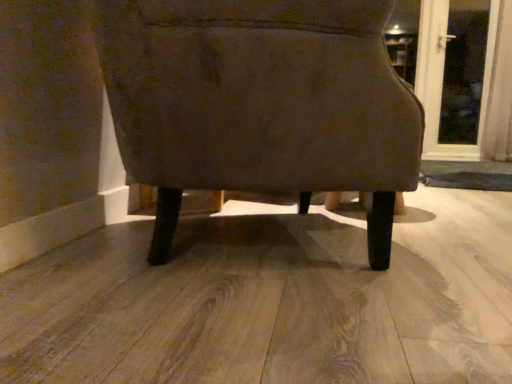
Describe the element at coordinates (259, 103) in the screenshot. I see `suede-like brown chair at center` at that location.

Find the location of `suede-like brown chair at center`. suede-like brown chair at center is located at coordinates (259, 103).

Locate an element on the screen. The image size is (512, 384). transparent glass door at upper right is located at coordinates (436, 81).

What do you see at coordinates (436, 81) in the screenshot? I see `transparent glass door at upper right` at bounding box center [436, 81].

This screenshot has height=384, width=512. I want to click on suede-like brown chair at center, so click(259, 103).

Considering the positions of objects transparent glass door at upper right and suede-like brown chair at center in the image provided, who is more to the right, transparent glass door at upper right or suede-like brown chair at center?

transparent glass door at upper right.

Which object is closer to the camera, transparent glass door at upper right or suede-like brown chair at center?

Positioned in front is suede-like brown chair at center.

Which is closer to the camera, (429, 150) or (229, 8)?

Point (429, 150).

From the image's perspective, which is below, transparent glass door at upper right or suede-like brown chair at center?

suede-like brown chair at center, from the image's perspective.

From the picture: From a real-world perspective, who is located lower, transparent glass door at upper right or suede-like brown chair at center?

suede-like brown chair at center, from a real-world perspective.

Considering the sizes of objects transparent glass door at upper right and suede-like brown chair at center in the image provided, who is wider, transparent glass door at upper right or suede-like brown chair at center?

Wider between the two is suede-like brown chair at center.

Is transparent glass door at upper right taller than suede-like brown chair at center?

Yes.

Between transparent glass door at upper right and suede-like brown chair at center, which one has larger size?

Bigger between the two is suede-like brown chair at center.

Is transparent glass door at upper right outside of suede-like brown chair at center?

Yes, transparent glass door at upper right is located beyond the bounds of suede-like brown chair at center.

Is transparent glass door at upper right far from suede-like brown chair at center?

Yes, transparent glass door at upper right and suede-like brown chair at center are quite far apart.

Is transparent glass door at upper right turned away from suede-like brown chair at center?

No, transparent glass door at upper right's orientation is not away from suede-like brown chair at center.

What's the angular difference between transparent glass door at upper right and suede-like brown chair at center's facing directions?

111 degrees.

Identify the location of screen door lying behind the suede-like brown chair at center. Image resolution: width=512 pixels, height=384 pixels. (436, 81).

Which object is positioned more to the right, suede-like brown chair at center or transparent glass door at upper right?

transparent glass door at upper right is more to the right.

Considering the positions of objects suede-like brown chair at center and transparent glass door at upper right in the image provided, who is in front, suede-like brown chair at center or transparent glass door at upper right?

suede-like brown chair at center is closer to the camera.

Considering the positions of point (219, 131) and point (464, 150), is point (219, 131) closer or farther from the camera than point (464, 150)?

Clearly, point (219, 131) is closer to the camera than point (464, 150).

From the image's perspective, relative to transparent glass door at upper right, is suede-like brown chair at center above or below?

Clearly, from the image's perspective, suede-like brown chair at center is below transparent glass door at upper right.

From a real-world perspective, is suede-like brown chair at center above or below transparent glass door at upper right?

In terms of real-world spatial position, suede-like brown chair at center is below transparent glass door at upper right.

Which object is wider, suede-like brown chair at center or transparent glass door at upper right?

Wider between the two is suede-like brown chair at center.

Does suede-like brown chair at center have a lesser height compared to transparent glass door at upper right?

Correct, suede-like brown chair at center is not as tall as transparent glass door at upper right.

Between suede-like brown chair at center and transparent glass door at upper right, which one has smaller size?

transparent glass door at upper right is smaller.

In the scene shown: Is suede-like brown chair at center not within transparent glass door at upper right?

That's correct, suede-like brown chair at center is outside of transparent glass door at upper right.

Are suede-like brown chair at center and transparent glass door at upper right far apart?

Yes, suede-like brown chair at center and transparent glass door at upper right are located far from each other.

Is transparent glass door at upper right at the back of suede-like brown chair at center?

That's not correct — suede-like brown chair at center is not looking away from transparent glass door at upper right.

You are a GUI agent. You are given a task and a screenshot of the screen. Output one action in this format:
    pyautogui.click(x=<x>, y=<y>)
    Task: Click on the chair in front of the transparent glass door at upper right
    
    Given the screenshot: What is the action you would take?
    (x=259, y=103)

This screenshot has width=512, height=384. Identify the location of chair in front of the transparent glass door at upper right. (259, 103).

At what (x,y) coordinates should I click in order to perform the action: click on screen door located behind the suede-like brown chair at center. Please return your answer as a coordinate pair (x, y). Looking at the image, I should click on (436, 81).